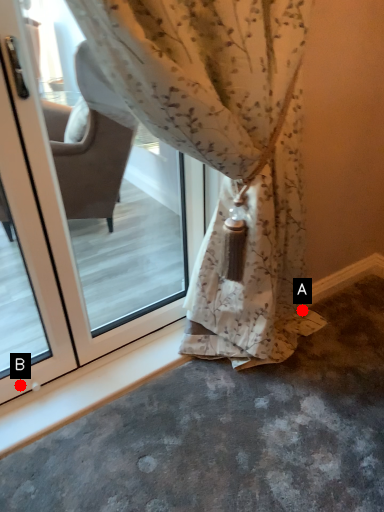
Question: Two points are circled on the image, labeled by A and B beside each circle. Among these points, which one is farthest from the camera?

Choices:
 (A) A is further
 (B) B is further

Answer: (A)